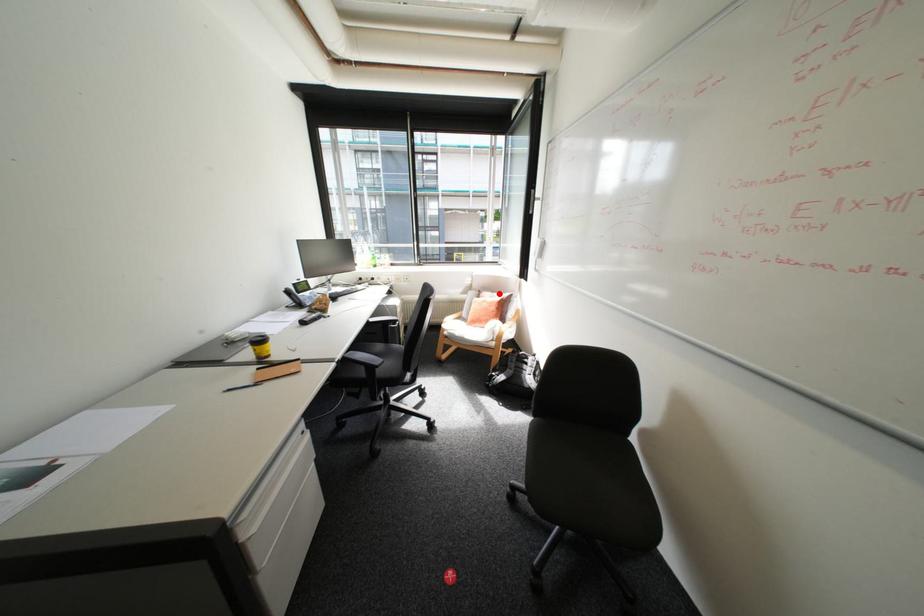
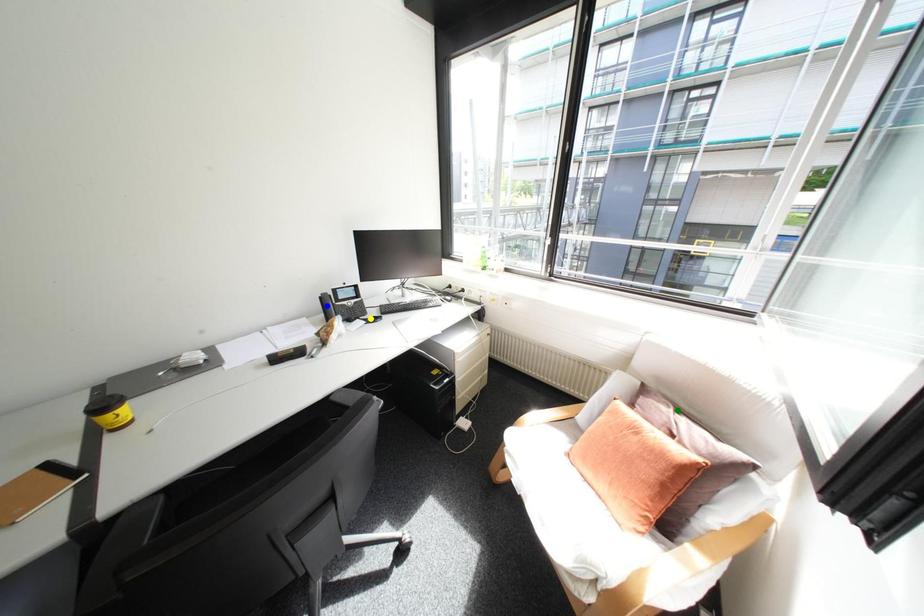
Question: I am providing you with two images of the same scene from different viewpoints. A red point is marked on the first image. You are given multiple points on the second image. Which mark in image 2 goes with the point in image 1?

Choices:
 (A) green point
 (B) yellow point
 (C) blue point

Answer: (A)